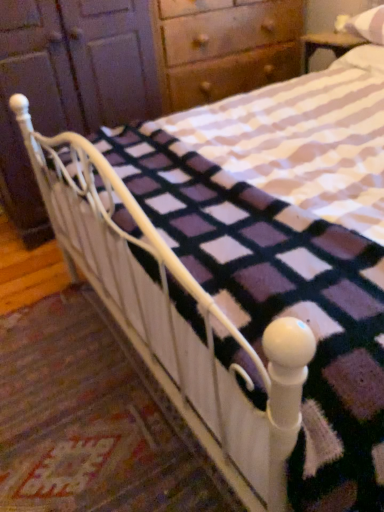
Question: Is white cotton pillow at upper right, which is the 2th pillow from top to bottom, thinner than matte wood dresser at upper left?

Choices:
 (A) yes
 (B) no

Answer: (A)

Question: Does white cotton pillow at upper right, positioned as the first pillow in bottom-to-top order, have a larger size compared to matte wood dresser at upper left?

Choices:
 (A) yes
 (B) no

Answer: (B)

Question: Is white cotton pillow at upper right, positioned as the first pillow in bottom-to-top order, taller than matte wood dresser at upper left?

Choices:
 (A) no
 (B) yes

Answer: (A)

Question: Considering the relative positions of white cotton pillow at upper right, positioned as the first pillow in bottom-to-top order, and matte wood dresser at upper left in the image provided, is white cotton pillow at upper right, positioned as the first pillow in bottom-to-top order, in front of matte wood dresser at upper left?

Choices:
 (A) no
 (B) yes

Answer: (A)

Question: Is white cotton pillow at upper right, positioned as the first pillow in bottom-to-top order, positioned beyond the bounds of matte wood dresser at upper left?

Choices:
 (A) yes
 (B) no

Answer: (A)

Question: Is white cotton pillow at upper right, positioned as the first pillow in bottom-to-top order, in front of or behind matte wood dresser at upper left in the image?

Choices:
 (A) behind
 (B) front

Answer: (A)

Question: From the image's perspective, is white cotton pillow at upper right, which is the 2th pillow from top to bottom, above or below matte wood dresser at upper left?

Choices:
 (A) above
 (B) below

Answer: (A)

Question: In terms of height, does white cotton pillow at upper right, positioned as the first pillow in bottom-to-top order, look taller or shorter compared to matte wood dresser at upper left?

Choices:
 (A) tall
 (B) short

Answer: (B)

Question: Considering the positions of white cotton pillow at upper right, positioned as the first pillow in bottom-to-top order, and matte wood dresser at upper left in the image, is white cotton pillow at upper right, positioned as the first pillow in bottom-to-top order, wider or thinner than matte wood dresser at upper left?

Choices:
 (A) thin
 (B) wide

Answer: (A)

Question: From a real-world perspective, is white soft pillow at upper right, the second pillow when ordered from bottom to top, above or below matte wood dresser at upper left?

Choices:
 (A) below
 (B) above

Answer: (B)

Question: From the image's perspective, is white soft pillow at upper right, which is counted as the 1th pillow, starting from the top, positioned above or below matte wood dresser at upper left?

Choices:
 (A) below
 (B) above

Answer: (B)

Question: In terms of width, does white soft pillow at upper right, which is counted as the 1th pillow, starting from the top, look wider or thinner when compared to matte wood dresser at upper left?

Choices:
 (A) wide
 (B) thin

Answer: (B)

Question: Considering their positions, is white soft pillow at upper right, which is counted as the 1th pillow, starting from the top, located in front of or behind matte wood dresser at upper left?

Choices:
 (A) behind
 (B) front

Answer: (A)

Question: Is matte wood dresser at upper left wider or thinner than white cotton pillow at upper right, which is the 2th pillow from top to bottom?

Choices:
 (A) wide
 (B) thin

Answer: (A)

Question: From a real-world perspective, is matte wood dresser at upper left above or below white cotton pillow at upper right, positioned as the first pillow in bottom-to-top order?

Choices:
 (A) above
 (B) below

Answer: (B)